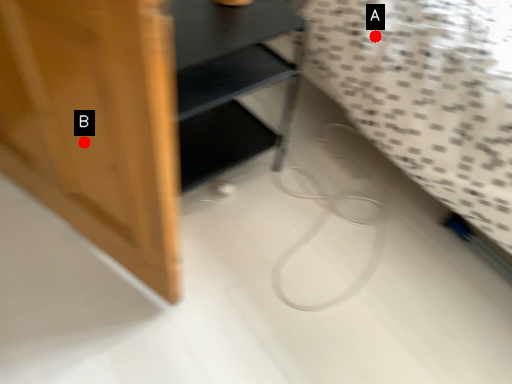
Question: Two points are circled on the image, labeled by A and B beside each circle. Which point is closer to the camera?

Choices:
 (A) A is closer
 (B) B is closer

Answer: (B)